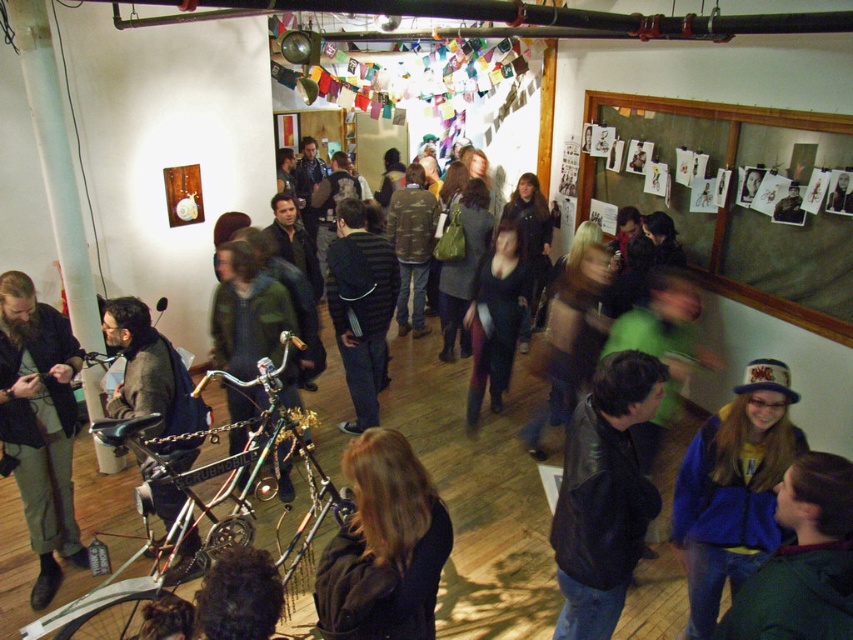
Consider the image. You are a visitor at the gallery and want to sit down on a bench located between the black leather jacket at center and the dark blue jacket at lower right. The bench is 1.2 meters wide. Can both jackets fit on the bench without overlapping?

The black leather jacket at center might be wider than dark blue jacket at lower right, so it is uncertain if both can fit on the 1.2 meter bench without overlapping. Measure the jackets first to confirm.

You are standing at the point marked as point (602, 493) in the image. What object are you currently standing on?

→ You are standing on the black leather jacket at center.